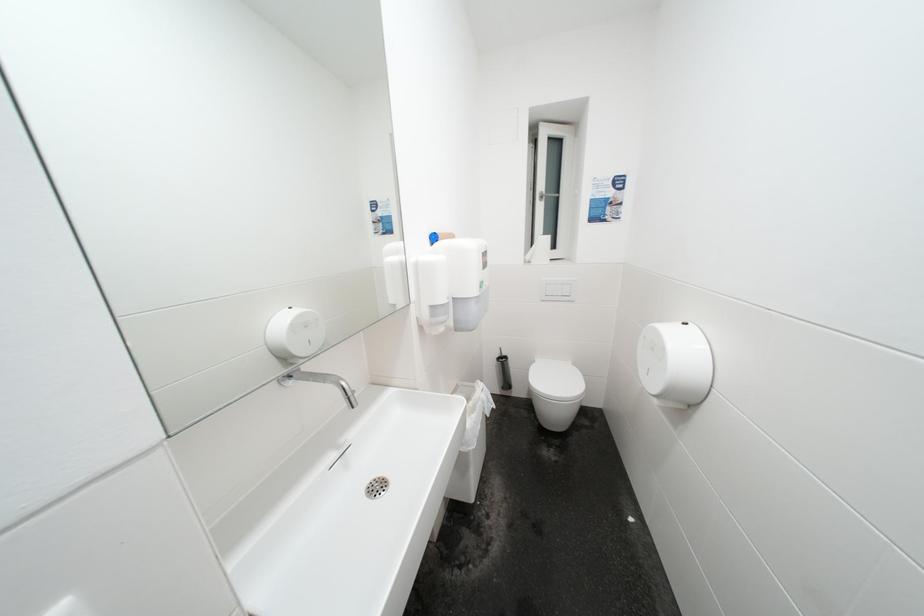
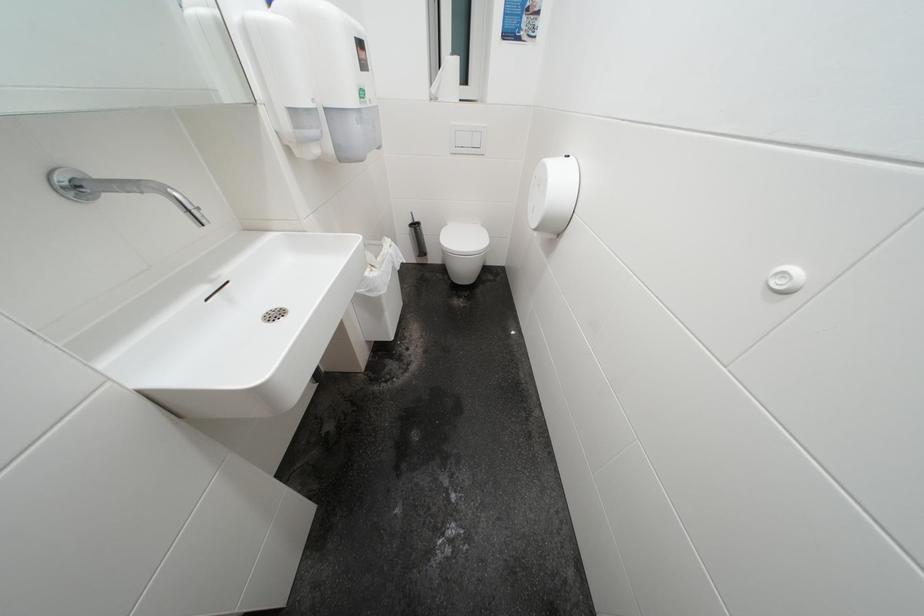
The images are taken continuously from a first-person perspective. In which direction is your viewpoint rotating?

The rotation direction of the camera is right-down.